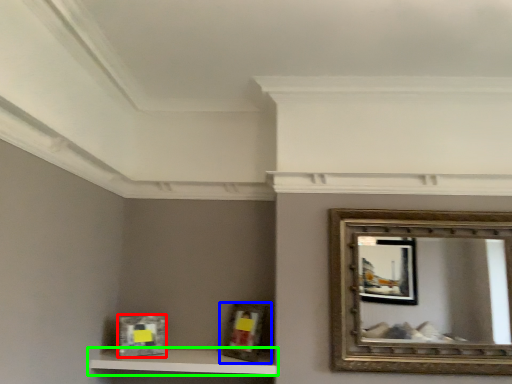
Question: Based on their relative distances, which object is farther from picture frame (highlighted by a red box)? Choose from picture frame (highlighted by a blue box) and shelf (highlighted by a green box).

Choices:
 (A) picture frame
 (B) shelf

Answer: (A)